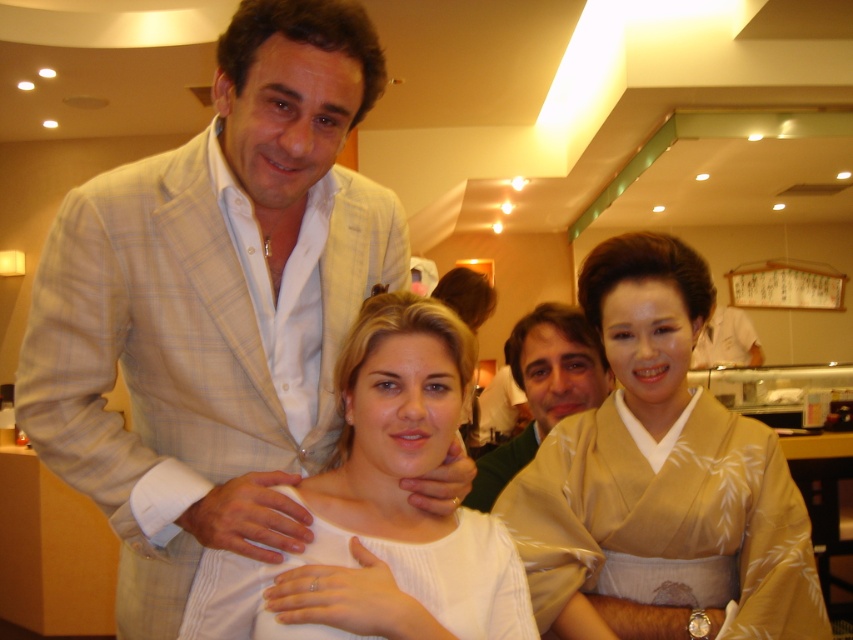
You are a photographer adjusting your camera settings. You notice the light beige plaid suit at left and the white ribbed sweater at center in your frame. Which object is positioned to the left of the other?

The light beige plaid suit at left is positioned to the left of the white ribbed sweater at center.

From the picture: You are a photographer setting up for a group photo. You notice the light beige plaid suit at left and the white ribbed sweater at center in the scene. Based on their positions, which clothing item might block the view of the other if they move closer to the camera?

The light beige plaid suit at left might block the view of the white ribbed sweater at center if they move closer to the camera, as the description suggests the light beige plaid suit at left could be wider than the white ribbed sweater at center.

You are a photographer setting up for a group photo. You have a camera with a lens that has a maximum focus range of 20 inches. You need to ensure that both the light beige plaid suit at left and beige silk kimono at center are in focus. Can you achieve this with your current camera settings?

The light beige plaid suit at left and beige silk kimono at center are 20.62 inches apart. Since the distance between them exceeds the camera lens maximum focus range of 20 inches, you cannot ensure both are in focus with the current settings.